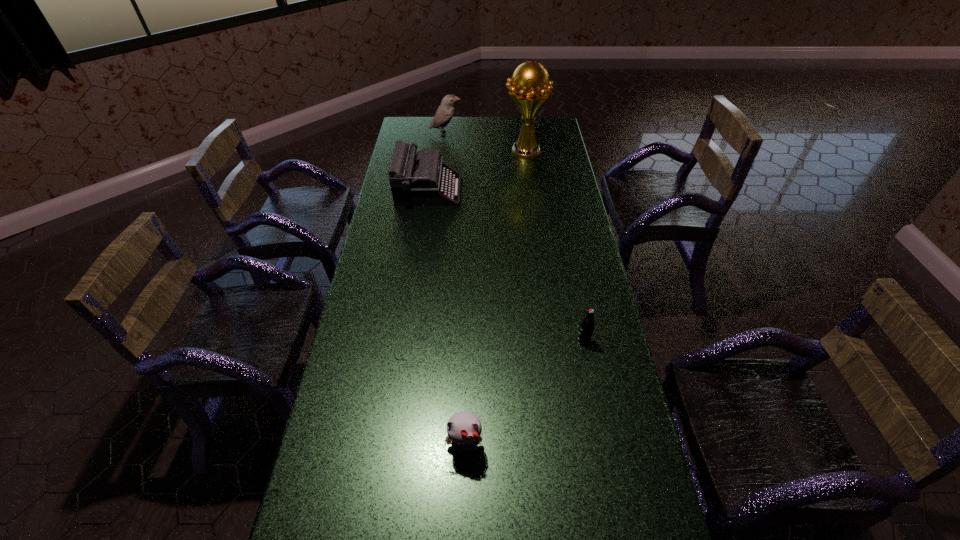
At what (x,y) coordinates should I click in order to perform the action: click on unoccupied position between the pop and the typewriter. Please return your answer as a coordinate pair (x, y). This screenshot has width=960, height=540. Looking at the image, I should click on (x=506, y=265).

I want to click on empty space between the bird and the tallest object, so click(x=485, y=143).

Find the location of a particular element. The image size is (960, 540). object that is the third closest to the typewriter is located at coordinates (587, 325).

Locate which object is the third closest to the fifth nearest object. Please provide its 2D coordinates. Your answer should be formatted as a tuple, i.e. [(x, y)], where the tuple contains the x and y coordinates of a point satisfying the conditions above.

[(587, 325)]